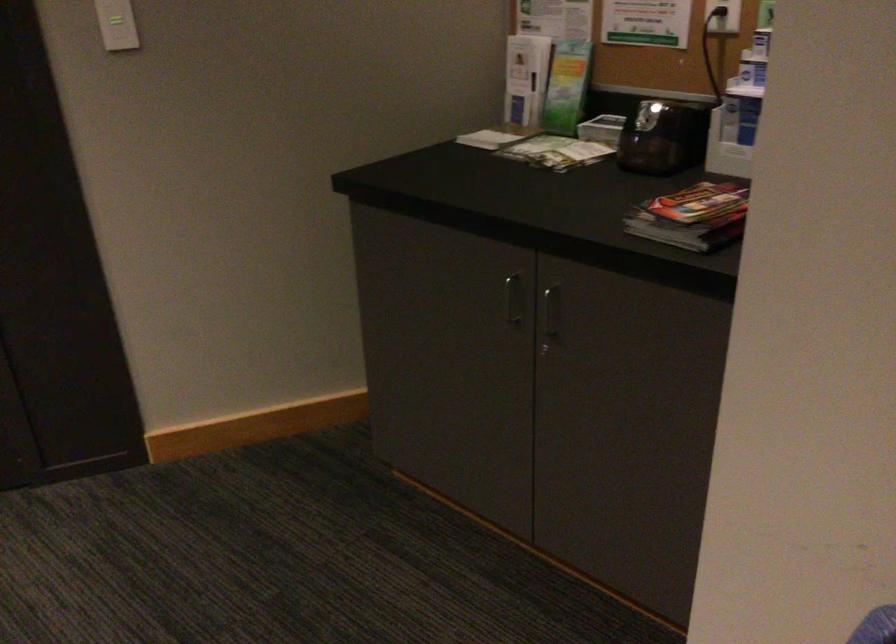
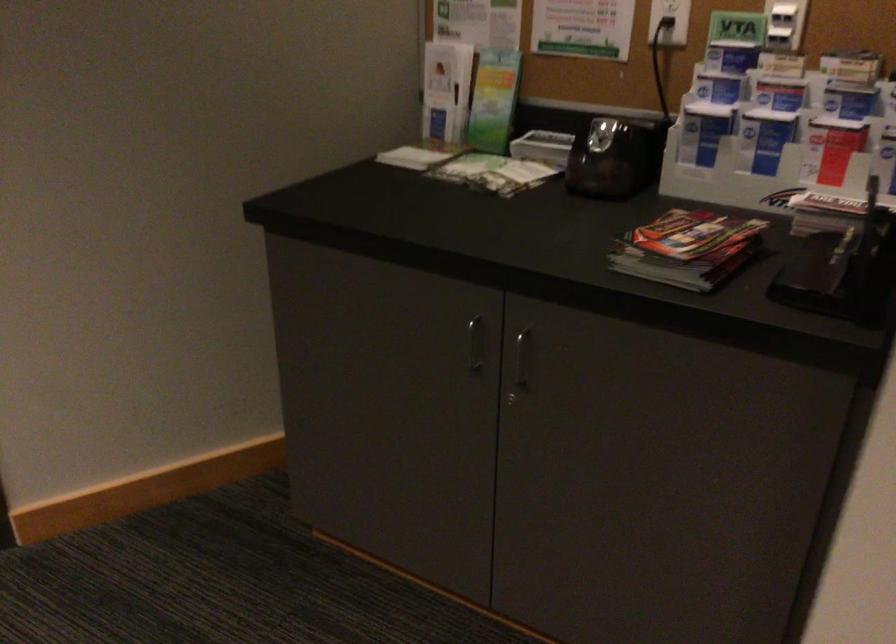
Where in the second image is the point corresponding to [695,216] from the first image?

(687, 249)